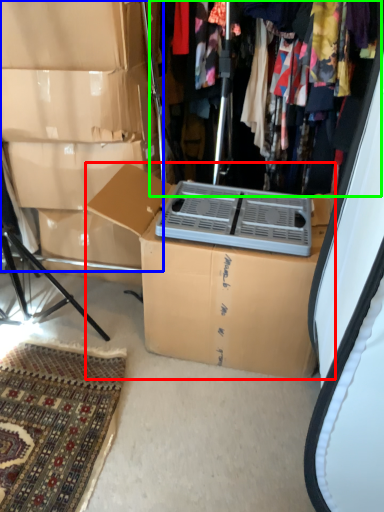
Question: Which is farther away from box (highlighted by a red box)? storage box (highlighted by a blue box) or closet (highlighted by a green box)?

Choices:
 (A) storage box
 (B) closet

Answer: (B)